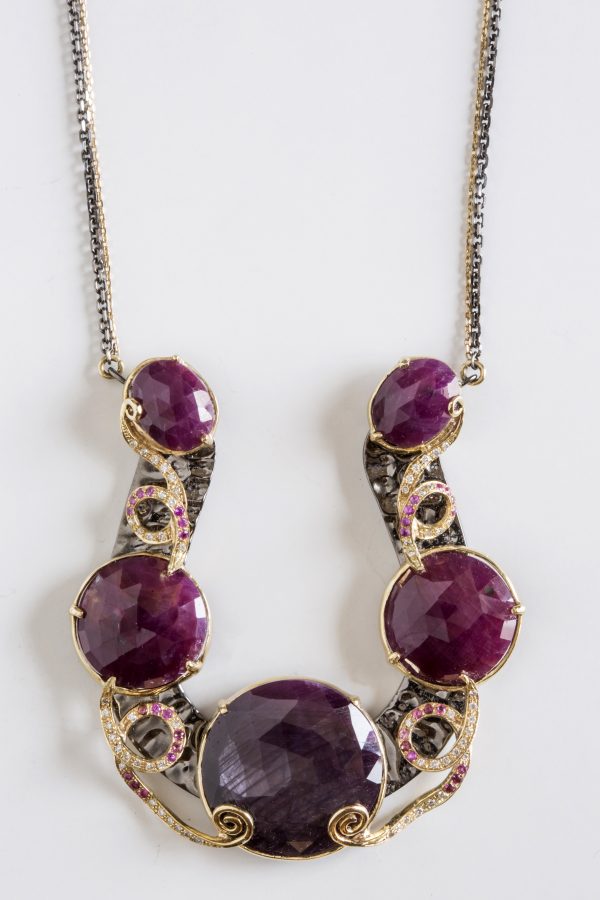
I want to click on jewelry plate, so click(399, 703), click(185, 774).